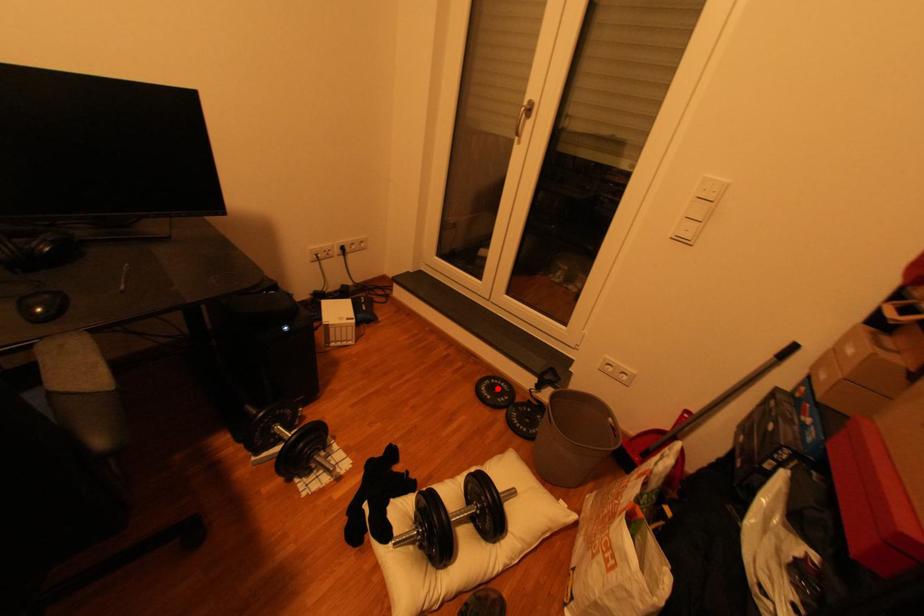
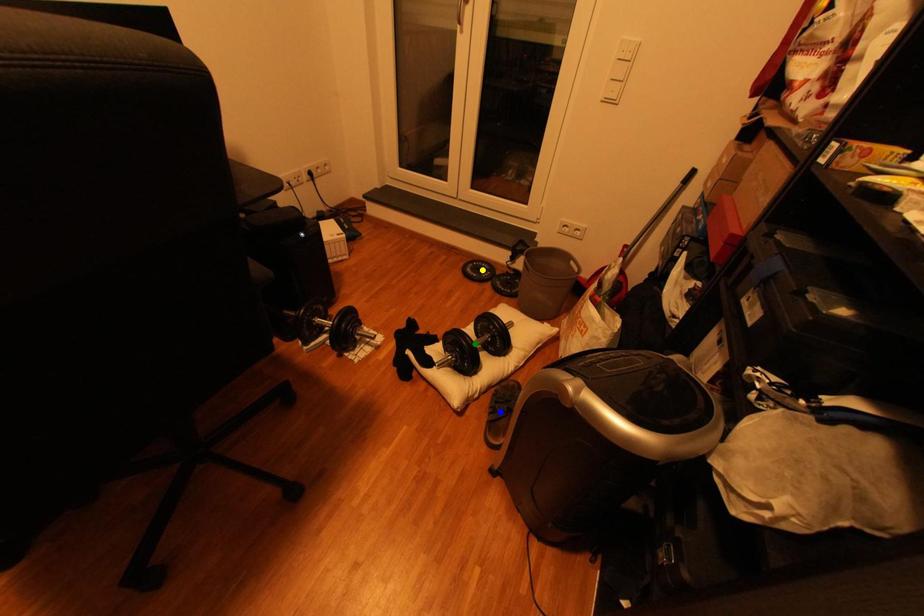
Question: I am providing you with two images of the same scene from different viewpoints. A red point is marked on the first image. You are given multiple points on the second image. In image 2, which mark is for the same physical point as the one in image 1?

Choices:
 (A) green point
 (B) blue point
 (C) yellow point

Answer: (C)